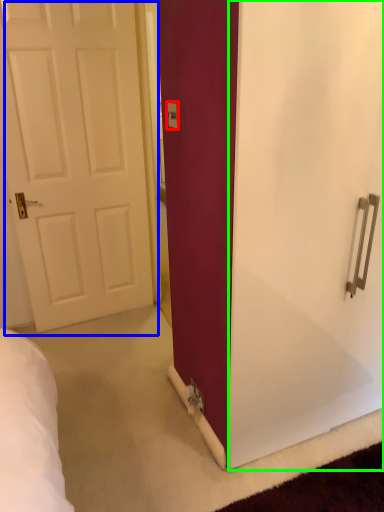
Question: Based on their relative distances, which object is nearer to electric outlet (highlighted by a red box)? Choose from door (highlighted by a blue box) and screen door (highlighted by a green box).

Choices:
 (A) door
 (B) screen door

Answer: (B)